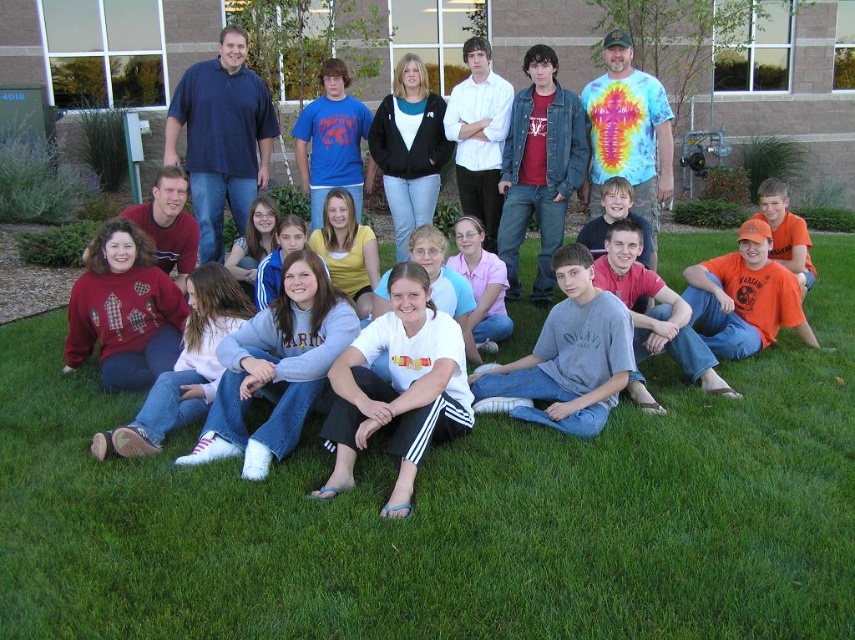
Question: Among these points, which one is nearest to the camera?

Choices:
 (A) (422, 364)
 (B) (587, 424)

Answer: (A)

Question: Which point is farther to the camera?

Choices:
 (A) gray cotton shirt at center
 (B) white cotton shirt at center

Answer: (A)

Question: Can you confirm if white cotton shirt at center is thinner than gray cotton shirt at center?

Choices:
 (A) no
 (B) yes

Answer: (B)

Question: Does green grass at lower center come behind gray cotton shirt at center?

Choices:
 (A) yes
 (B) no

Answer: (B)

Question: Does white cotton shirt at center lie behind gray cotton shirt at center?

Choices:
 (A) no
 (B) yes

Answer: (A)

Question: Which point is closer to the camera?

Choices:
 (A) white cotton shirt at center
 (B) green grass at lower center
 (C) gray cotton shirt at center

Answer: (B)